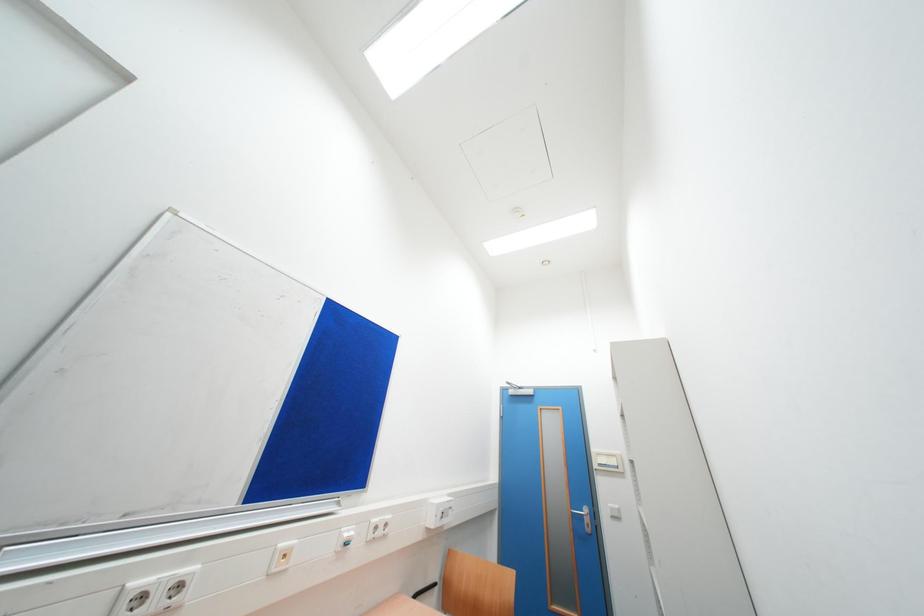
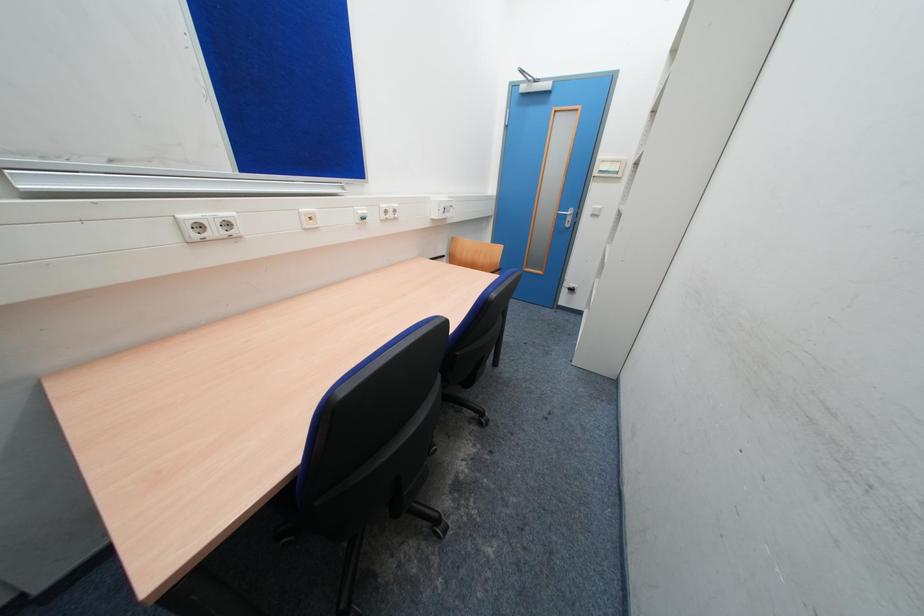
Question: The images are taken continuously from a first-person perspective. In which direction is your viewpoint rotating?

Choices:
 (A) Left
 (B) Right
 (C) Up
 (D) Down

Answer: (D)